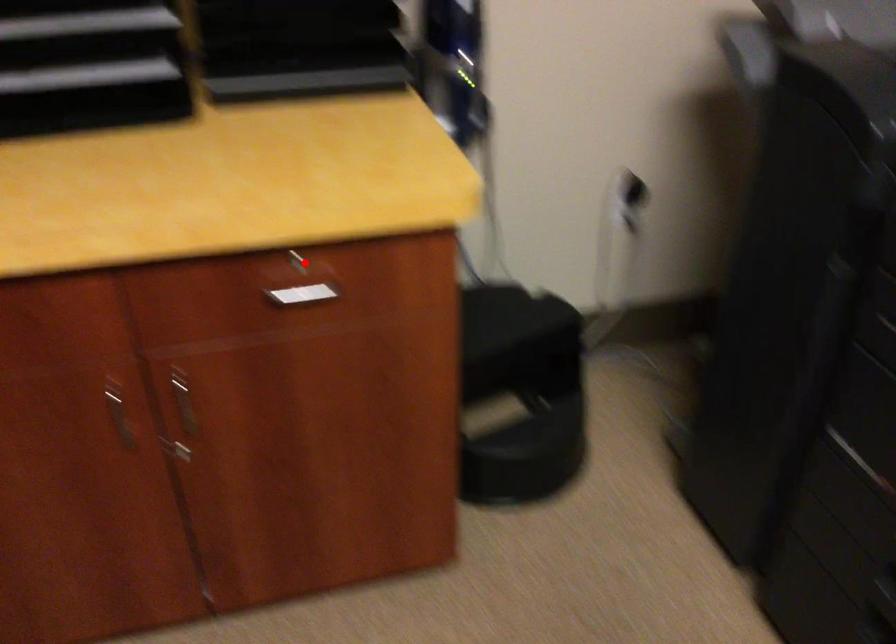
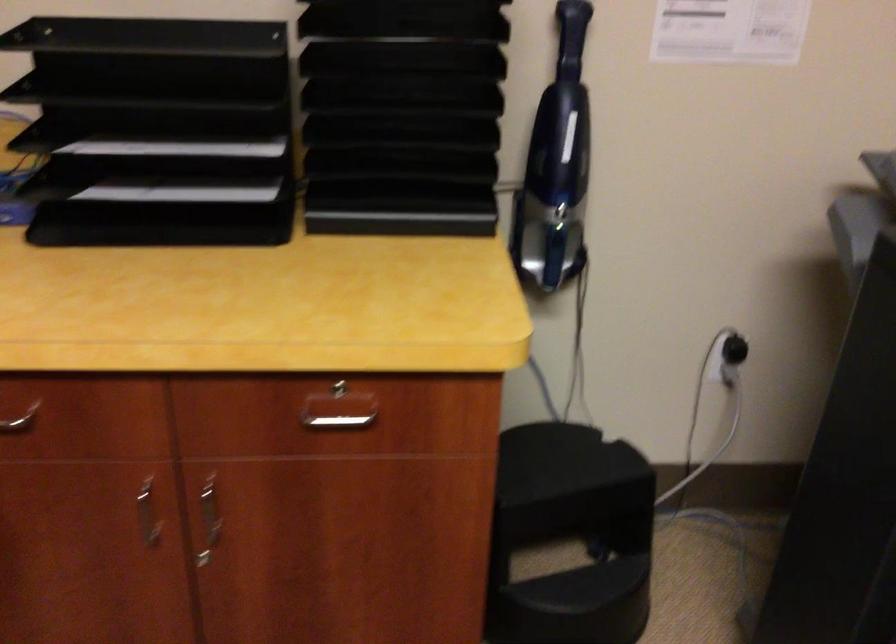
In the second image, find the point that corresponds to the highlighted location in the first image.

(342, 391)